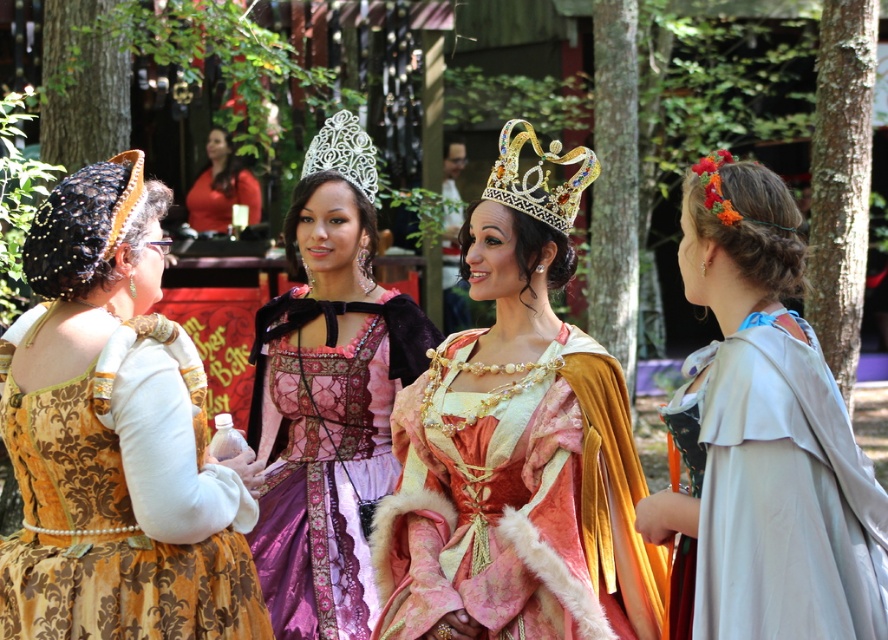
Question: Which of the following is the closest to the observer?

Choices:
 (A) matte red dress at upper center
 (B) floral fabric headband at upper right
 (C) gold jeweled crown at center

Answer: (B)

Question: Is gold damask dress at left positioned behind silk blue dress at right?

Choices:
 (A) no
 (B) yes

Answer: (B)

Question: Which point is farther to the camera?

Choices:
 (A) (250, 564)
 (B) (355, 621)
 (C) (767, 246)

Answer: (B)

Question: Does gold jeweled crown at center appear under matte red dress at upper center?

Choices:
 (A) yes
 (B) no

Answer: (A)

Question: Which point is closer to the camera?

Choices:
 (A) floral fabric headband at upper right
 (B) gold jeweled crown at center
 (C) matte red dress at upper center

Answer: (A)

Question: Does velvet gold crown at center have a greater width compared to purple satin dress at center?

Choices:
 (A) yes
 (B) no

Answer: (A)